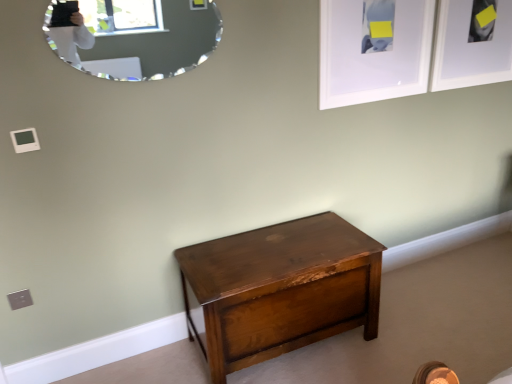
Find the location of `free space above shiny brown wood chest at center (from a real-world perspective)`. free space above shiny brown wood chest at center (from a real-world perspective) is located at coordinates (273, 249).